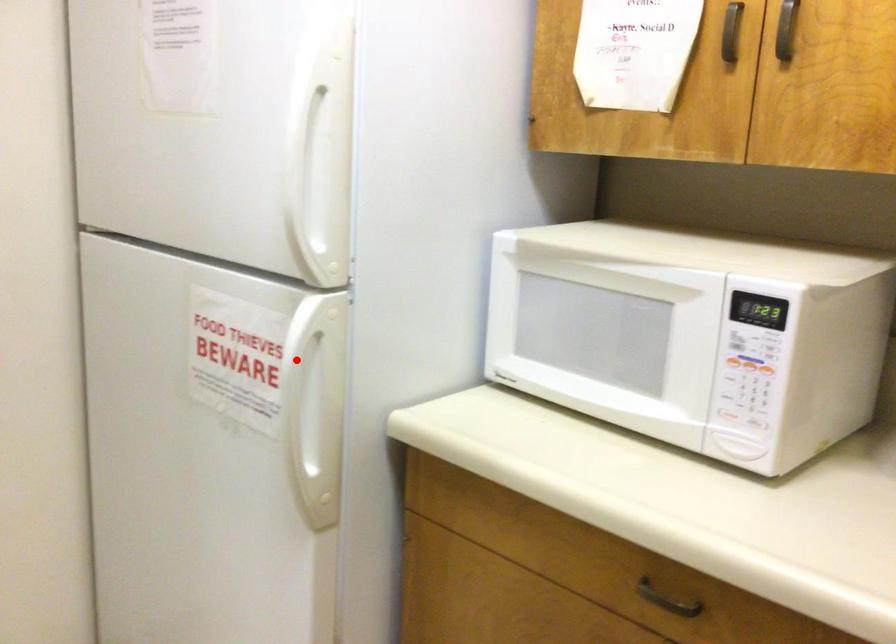
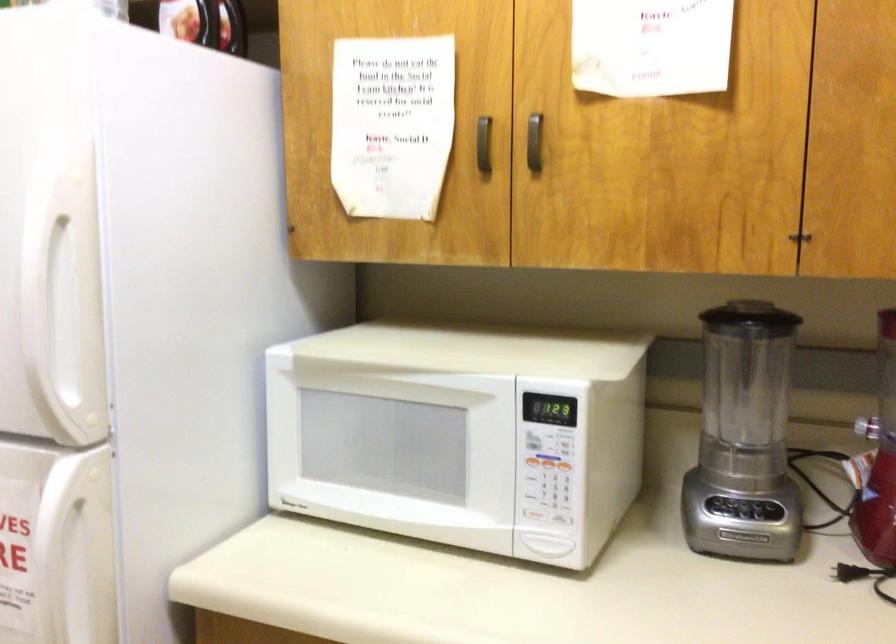
The point at the highlighted location is marked in the first image. Where is the corresponding point in the second image?

(57, 538)